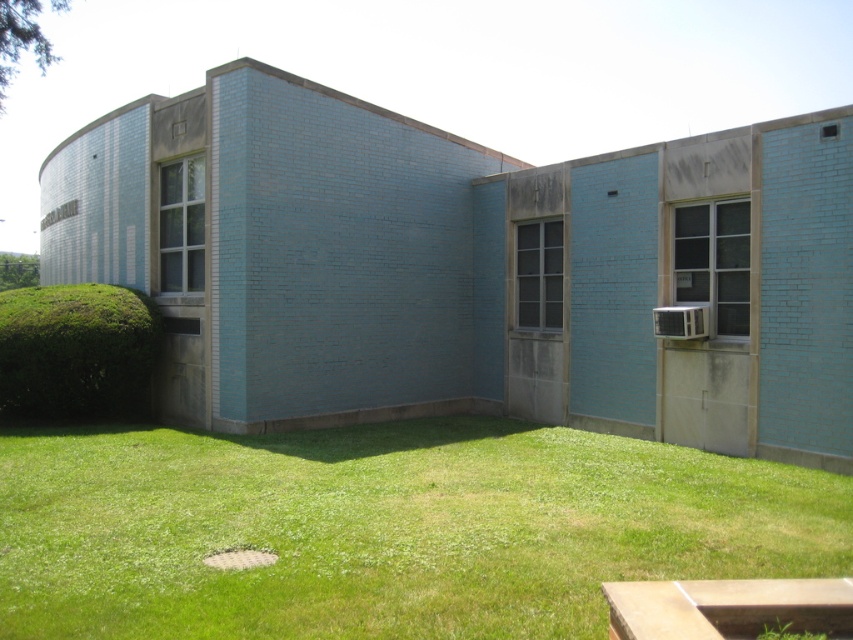
Question: Is green grass at lower center positioned at the back of green leafy hedge at lower left?

Choices:
 (A) yes
 (B) no

Answer: (B)

Question: Which object appears farthest from the camera in this image?

Choices:
 (A) green grass at lower center
 (B) green leafy hedge at lower left

Answer: (B)

Question: Among these points, which one is nearest to the camera?

Choices:
 (A) (85, 362)
 (B) (532, 477)

Answer: (B)

Question: Can you confirm if green grass at lower center is positioned above green leafy hedge at lower left?

Choices:
 (A) no
 (B) yes

Answer: (A)

Question: Is green grass at lower center above green leafy hedge at lower left?

Choices:
 (A) yes
 (B) no

Answer: (B)

Question: Which point appears farthest from the camera in this image?

Choices:
 (A) (3, 525)
 (B) (62, 365)

Answer: (B)